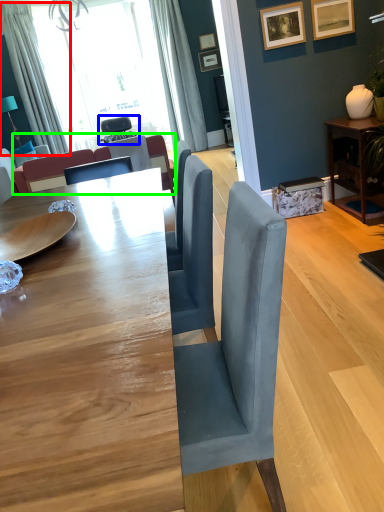
Question: Estimate the real-world distances between objects in this image. Which object is closer to curtain (highlighted by a red box), chair (highlighted by a blue box) or couch (highlighted by a green box)?

Choices:
 (A) chair
 (B) couch

Answer: (A)